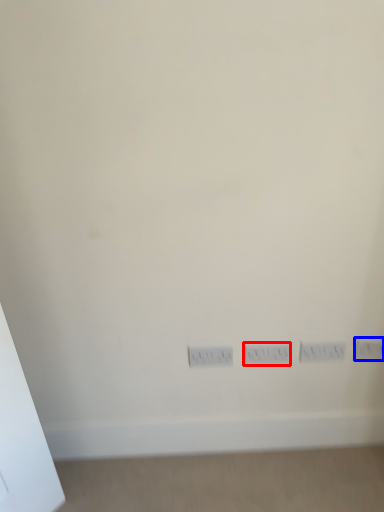
Question: Which of the following is the farthest to the observer, switch (highlighted by a red box) or electric outlet (highlighted by a blue box)?

Choices:
 (A) switch
 (B) electric outlet

Answer: (B)